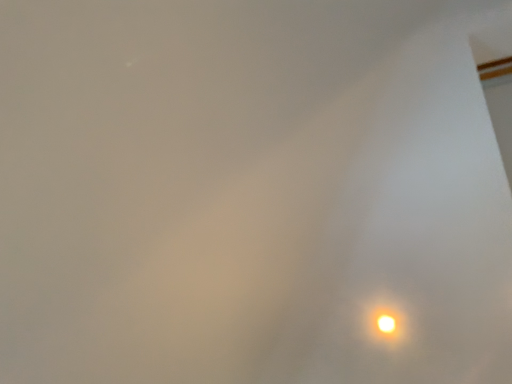
What do you see at coordinates (387, 323) in the screenshot?
I see `bright orange light at bottom right` at bounding box center [387, 323].

Locate an element on the screen. The image size is (512, 384). bright orange light at bottom right is located at coordinates (387, 323).

Find the location of a particular element. bright orange light at bottom right is located at coordinates (387, 323).